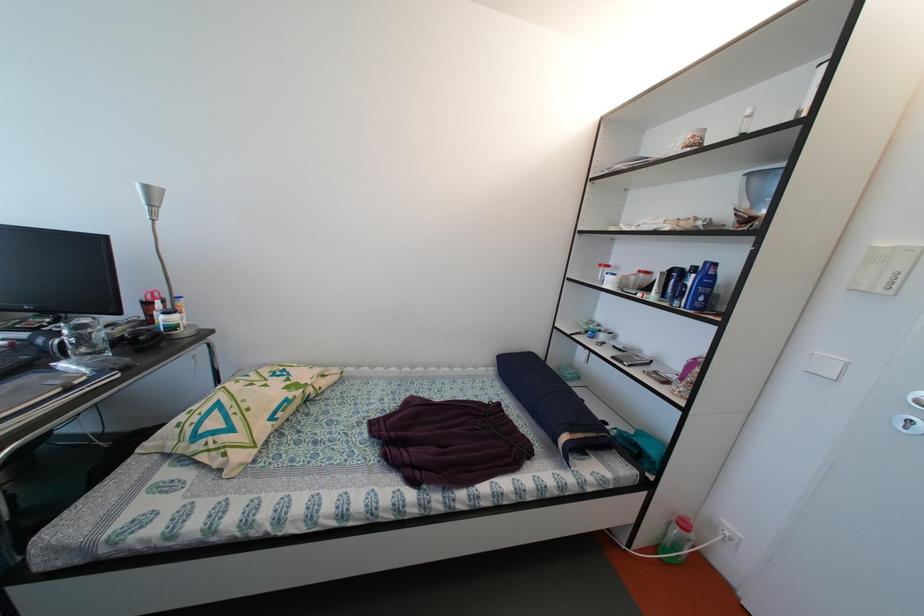
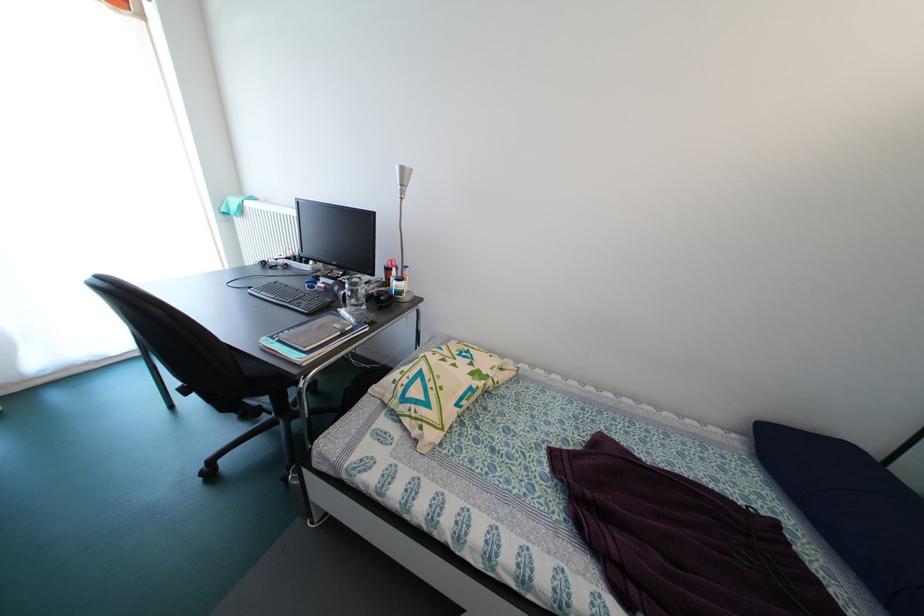
In the second image, find the point that corresponds to (x=154, y=193) in the first image.

(409, 175)